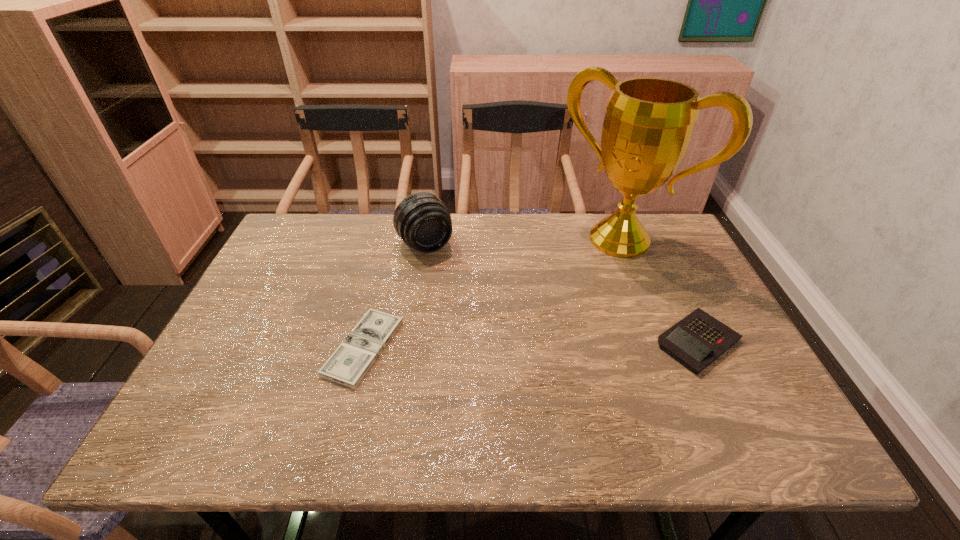
Image resolution: width=960 pixels, height=540 pixels. In order to click on vacant space in between the shortest object and the calculator in this screenshot , I will do `click(531, 345)`.

I want to click on free area in between the tallest object and the second shortest object, so click(x=660, y=291).

Where is `vacant area that lies between the third tallest object and the dollar`? This screenshot has height=540, width=960. vacant area that lies between the third tallest object and the dollar is located at coordinates (531, 345).

Where is `unoccupied position between the calculator and the second tallest object`? This screenshot has height=540, width=960. unoccupied position between the calculator and the second tallest object is located at coordinates (562, 293).

Identify the location of unoccupied position between the dollar and the second shortest object. (531, 345).

Identify which object is the closest to the third shortest object. Please provide its 2D coordinates. Your answer should be formatted as a tuple, i.e. [(x, y)], where the tuple contains the x and y coordinates of a point satisfying the conditions above.

[(349, 363)]

In order to click on object that stands as the third closest to the calculator in this screenshot , I will do `click(349, 363)`.

The width and height of the screenshot is (960, 540). I want to click on free location that satisfies the following two spatial constraints: 1. on the back side of the tallest object; 2. on the right side of the shortest object, so click(391, 240).